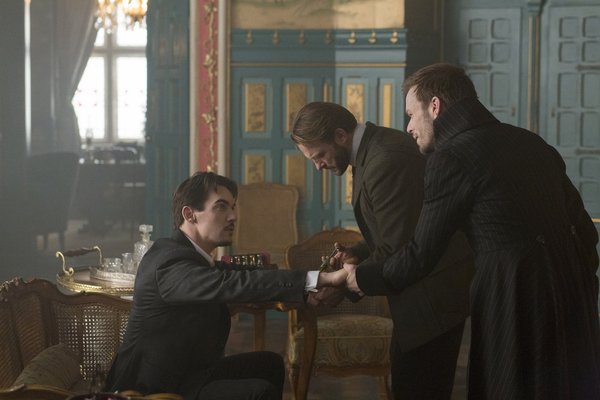
This screenshot has width=600, height=400. Find the location of `chair`. chair is located at coordinates (46, 330), (274, 231), (320, 245).